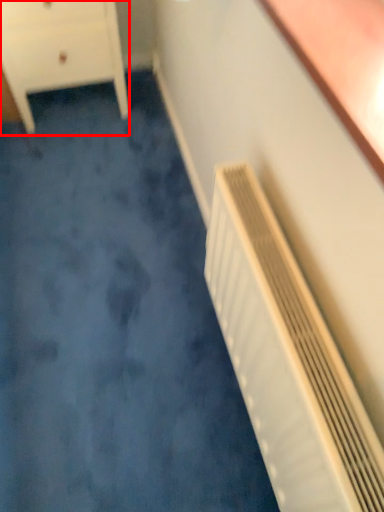
Question: Observing the image, what is the correct spatial positioning of chest of drawers (annotated by the red box) in reference to air conditioning?

Choices:
 (A) left
 (B) right

Answer: (A)